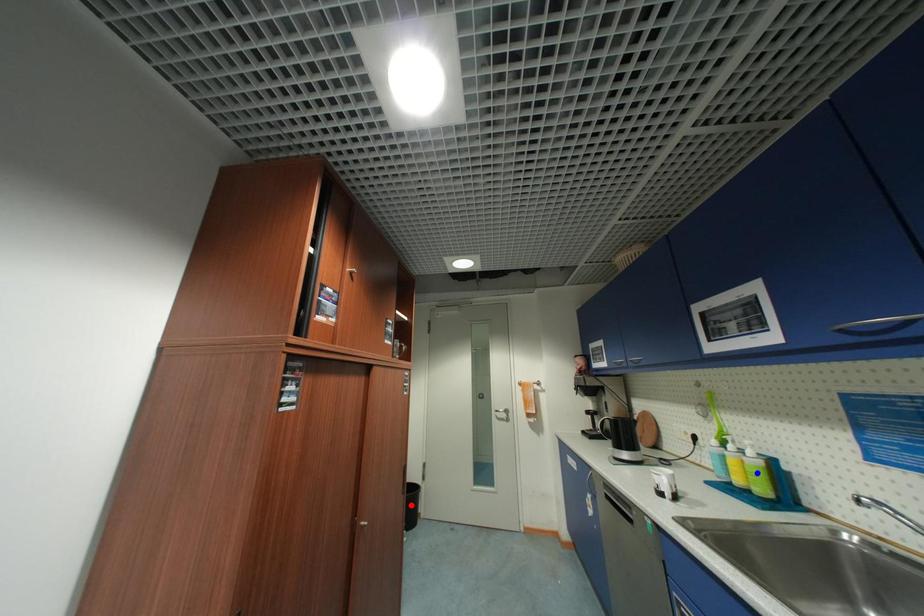
Question: In the image, two points are highlighted. Which point is nearer to the camera? Reply with the corresponding letter.

Choices:
 (A) blue point
 (B) red point

Answer: (A)